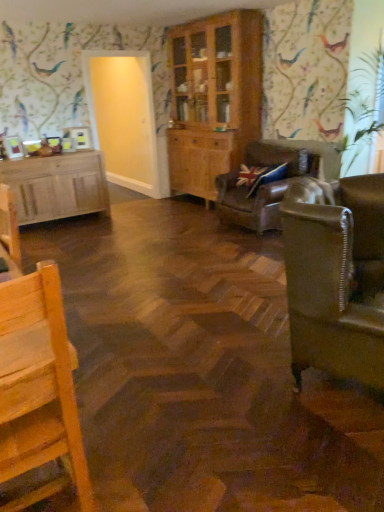
Question: Should I look upward or downward to see light wood cabinet at left, arranged as the first cabinetry when viewed from the left?

Choices:
 (A) down
 (B) up

Answer: (B)

Question: From the image's perspective, does leather couch at right, which is the 1th studio couch from front to back, appear higher than leather sofa at center, the first studio couch viewed from the back?

Choices:
 (A) yes
 (B) no

Answer: (B)

Question: Is leather couch at right, positioned as the second studio couch in back-to-front order, bigger than leather sofa at center, which is counted as the second studio couch, starting from the front?

Choices:
 (A) no
 (B) yes

Answer: (A)

Question: Is leather sofa at center, which is counted as the second studio couch, starting from the front, a part of leather couch at right, which is the 1th studio couch from front to back?

Choices:
 (A) yes
 (B) no

Answer: (B)

Question: Does leather couch at right, which is the 1th studio couch from front to back, have a smaller size compared to leather sofa at center, which is counted as the second studio couch, starting from the front?

Choices:
 (A) no
 (B) yes

Answer: (B)

Question: Considering the relative positions of leather couch at right, which is the 1th studio couch from front to back, and leather sofa at center, the first studio couch viewed from the back, in the image provided, is leather couch at right, which is the 1th studio couch from front to back, to the right of leather sofa at center, the first studio couch viewed from the back, from the viewer's perspective?

Choices:
 (A) yes
 (B) no

Answer: (B)

Question: From a real-world perspective, is leather couch at right, positioned as the second studio couch in back-to-front order, positioned over leather sofa at center, which is counted as the second studio couch, starting from the front, based on gravity?

Choices:
 (A) yes
 (B) no

Answer: (A)

Question: Is light wood cabinet at left, marked as the 2th cabinetry in a right-to-left arrangement, bigger than wooden cabinet at center, which is the 2th cabinetry from left to right?

Choices:
 (A) no
 (B) yes

Answer: (A)

Question: Is light wood cabinet at left, arranged as the first cabinetry when viewed from the left, at the right side of wooden cabinet at center, arranged as the 1th cabinetry when viewed from the right?

Choices:
 (A) no
 (B) yes

Answer: (A)

Question: Is light wood cabinet at left, arranged as the first cabinetry when viewed from the left, with wooden cabinet at center, arranged as the 1th cabinetry when viewed from the right?

Choices:
 (A) yes
 (B) no

Answer: (B)

Question: Is there a large distance between light wood cabinet at left, arranged as the first cabinetry when viewed from the left, and wooden cabinet at center, arranged as the 1th cabinetry when viewed from the right?

Choices:
 (A) yes
 (B) no

Answer: (A)

Question: From a real-world perspective, is light wood cabinet at left, marked as the 2th cabinetry in a right-to-left arrangement, under wooden cabinet at center, which is the 2th cabinetry from left to right?

Choices:
 (A) no
 (B) yes

Answer: (B)

Question: Is light wood cabinet at left, marked as the 2th cabinetry in a right-to-left arrangement, oriented towards wooden cabinet at center, arranged as the 1th cabinetry when viewed from the right?

Choices:
 (A) no
 (B) yes

Answer: (A)

Question: Considering the relative sizes of leather sofa at center, which is counted as the second studio couch, starting from the front, and transparent glass door at upper left in the image provided, is leather sofa at center, which is counted as the second studio couch, starting from the front, wider than transparent glass door at upper left?

Choices:
 (A) yes
 (B) no

Answer: (A)